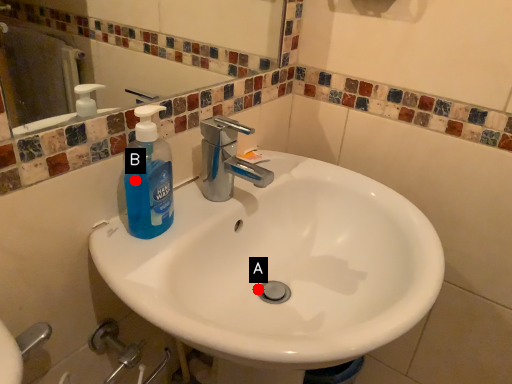
Question: Two points are circled on the image, labeled by A and B beside each circle. Among these points, which one is farthest from the camera?

Choices:
 (A) A is further
 (B) B is further

Answer: (A)